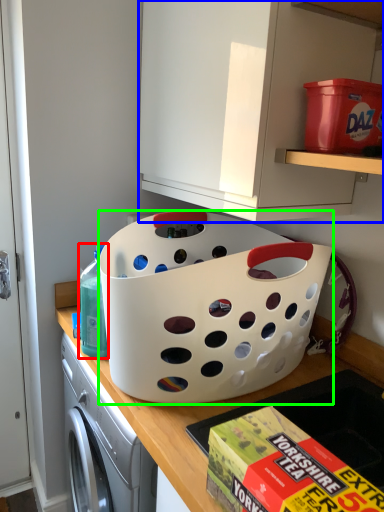
Question: Which object is the farthest from cleaning product (highlighted by a red box)? Choose among these: cabinetry (highlighted by a blue box) or basket (highlighted by a green box).

Choices:
 (A) cabinetry
 (B) basket

Answer: (A)